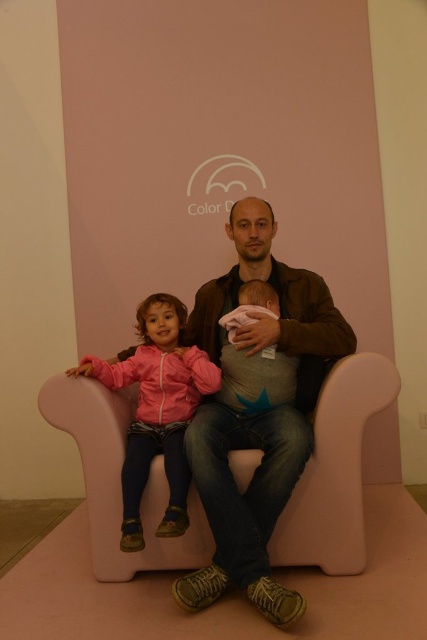
Between point (187, 464) and point (237, 321), which one is positioned behind?

The point (237, 321) is more distant.

Which is more to the left, pink matte jacket at center or soft pink fabric baby at center?

pink matte jacket at center

You are a GUI agent. You are given a task and a screenshot of the screen. Output one action in this format:
    pyautogui.click(x=<x>, y=<y>)
    Task: Click on the pink matte jacket at center
    
    Given the screenshot: What is the action you would take?
    pyautogui.click(x=157, y=410)

Who is taller, brown leather jacket at center or pink foam armchair at center?

With more height is brown leather jacket at center.

Is brown leather jacket at center closer to camera compared to pink foam armchair at center?

Yes, it is.

Between point (248, 426) and point (382, 356), which one is positioned behind?

Point (248, 426)

Identify the location of brown leather jacket at center. The image size is (427, 640). (257, 413).

Measure the distance between pink foam armchair at center and soft pink fabric baby at center.

pink foam armchair at center is 19.92 inches away from soft pink fabric baby at center.

Describe the element at coordinates (336, 472) in the screenshot. I see `pink foam armchair at center` at that location.

Who is more distant from viewer, (69, 428) or (274, 308)?

The point (274, 308) is more distant.

Find the location of `pink foam armchair at center`. pink foam armchair at center is located at coordinates (336, 472).